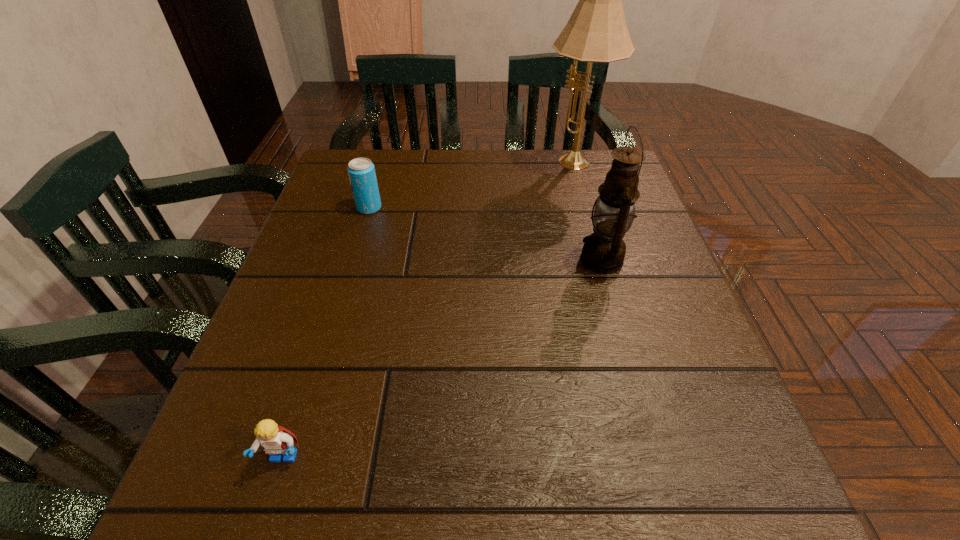
You are a GUI agent. You are given a task and a screenshot of the screen. Output one action in this format:
    pyautogui.click(x=<x>, y=<y>)
    Task: Click on the tallest object
    The image size is (960, 540).
    Given the screenshot: What is the action you would take?
    pyautogui.click(x=596, y=32)

Find the location of `the farthest object`. the farthest object is located at coordinates (596, 32).

You are a GUI agent. You are given a task and a screenshot of the screen. Output one action in this format:
    pyautogui.click(x=<x>, y=<y>)
    Task: Click on the third farthest object
    The height and width of the screenshot is (540, 960).
    Given the screenshot: What is the action you would take?
    pyautogui.click(x=603, y=251)

Identify the location of oil lamp. The width and height of the screenshot is (960, 540). (603, 251).

Locate an element on the screen. the third tallest object is located at coordinates (361, 171).

What are the coordinates of `soda can` in the screenshot? It's located at (361, 171).

Identify the location of the nearest object. The width and height of the screenshot is (960, 540). (275, 440).

Identify the location of the shortest object. Image resolution: width=960 pixels, height=540 pixels. (275, 440).

The width and height of the screenshot is (960, 540). I want to click on vacant space located 0.140m on the front of the lampshade, so click(588, 217).

Find the location of a particular element. This screenshot has height=540, width=960. free space located 0.370m on the front of the third farthest object is located at coordinates (660, 465).